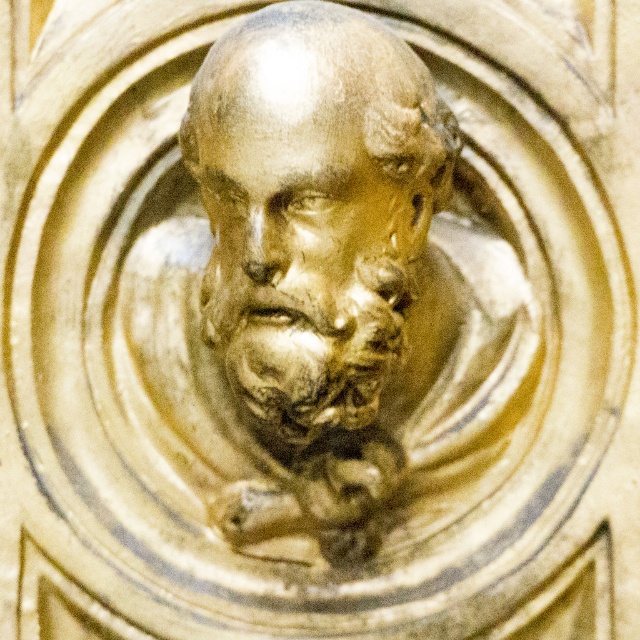
Question: Among these objects, which one is farthest from the camera?

Choices:
 (A) gold textured bust at center
 (B) golden stone face at center

Answer: (B)

Question: Which point is closer to the camera taking this photo?

Choices:
 (A) coord(353,369)
 (B) coord(332,332)

Answer: (B)

Question: Does gold textured bust at center appear on the left side of golden stone face at center?

Choices:
 (A) no
 (B) yes

Answer: (A)

Question: Is the position of gold textured bust at center more distant than that of golden stone face at center?

Choices:
 (A) yes
 (B) no

Answer: (B)

Question: Which point is closer to the camera taking this photo?

Choices:
 (A) click(x=230, y=288)
 (B) click(x=339, y=390)

Answer: (B)

Question: Observing the image, what is the correct spatial positioning of gold textured bust at center in reference to golden stone face at center?

Choices:
 (A) left
 (B) right

Answer: (B)